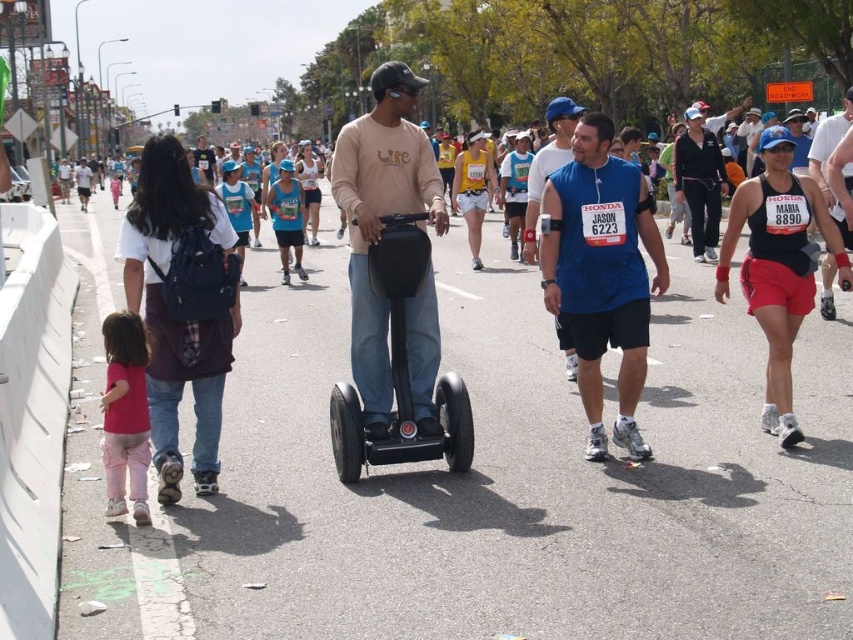
Is point (592, 147) less distant than point (155, 442)?

No, it is behind (155, 442).

Which is above, blue fabric shirt at center or dark brown backpack at left?

blue fabric shirt at center is above.

You are a GUI agent. You are given a task and a screenshot of the screen. Output one action in this format:
    pyautogui.click(x=<x>, y=<y>)
    Task: Click on the blue fabric shirt at center
    Image resolution: width=853 pixels, height=640 pixels.
    Given the screenshot: What is the action you would take?
    pyautogui.click(x=601, y=275)

Image resolution: width=853 pixels, height=640 pixels. I want to click on blue fabric shirt at center, so click(601, 275).

Does dark brown backpack at left have a greater width compared to blue fabric tank top at center?

No, dark brown backpack at left is not wider than blue fabric tank top at center.

Does point (157, 189) lie in front of point (566, 372)?

Yes, it is.

Is point (187, 164) closer to camera compared to point (550, 125)?

Yes, it is in front of point (550, 125).

Where is `dark brown backpack at left`? This screenshot has width=853, height=640. dark brown backpack at left is located at coordinates (180, 317).

Which of these two, matte beige sweatshirt at center or black matte tank top at right, stands taller?

matte beige sweatshirt at center

Is point (367, 260) in front of point (770, 141)?

Yes, point (367, 260) is in front of point (770, 141).

The image size is (853, 640). I want to click on matte beige sweatshirt at center, so click(380, 218).